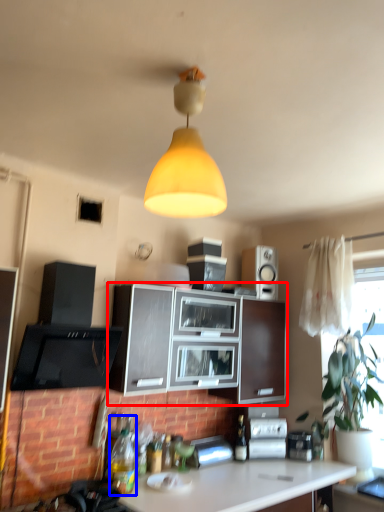
Question: Which point is further to the camera, cabinetry (highlighted by a red box) or bottle (highlighted by a blue box)?

Choices:
 (A) cabinetry
 (B) bottle

Answer: (A)